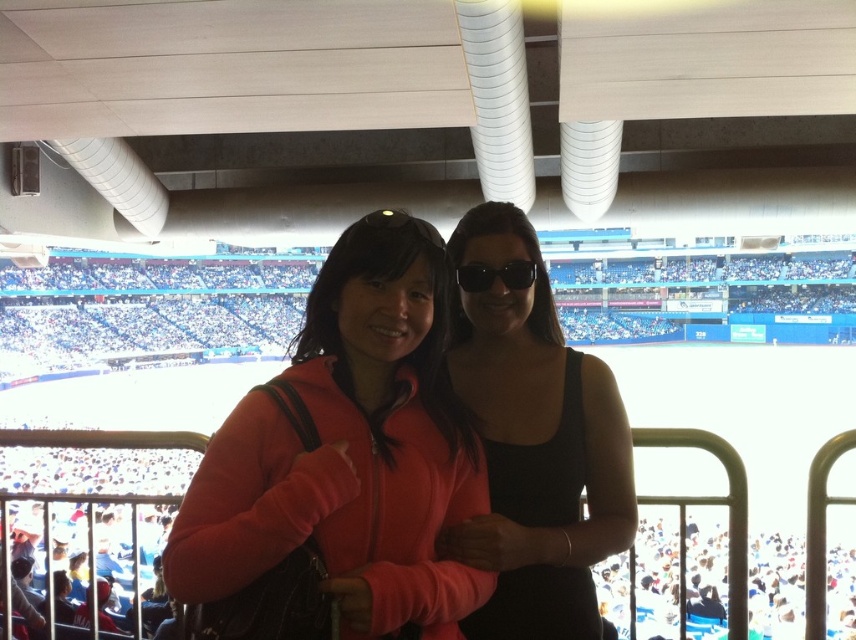
In the scene shown: You are a photographer trying to decide which subject to focus on. The matte orange jacket at center and the black matte tank top at center are both in the frame. Which clothing item appears smaller in size?

The matte orange jacket at center has a smaller size compared to the black matte tank top at center, so the matte orange jacket at center appears smaller.

You are a photographer trying to capture a candid shot of both the matte orange jacket at center and the black matte tank top at center. Since you want to ensure both subjects are in focus, which one should you focus on first to account for their positions?

You should focus on the matte orange jacket at center first because the black matte tank top at center is behind it, so adjusting focus starting from the front subject ensures both can be in focus.

Consider the image. You are at a stadium and want to take a photo with two people wearing matte orange jacket at center and black matte tank top at center. If you stand directly in front of them, which one will be on your left side?

The matte orange jacket at center is to the left of black matte tank top at center, so the matte orange jacket at center will be on your left side.